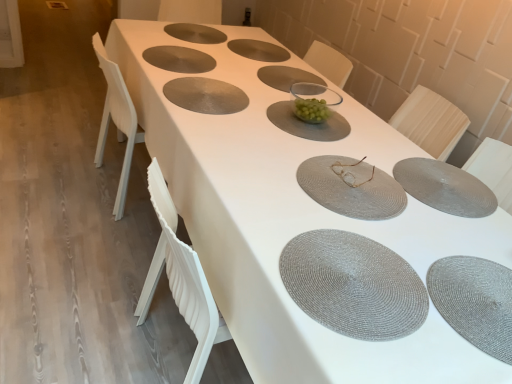
The width and height of the screenshot is (512, 384). Find the location of `vacant space that is in between matte gray placemat at center, the seventh tableware when ordered from top to bottom, and green glass bowl at center, positioned as the 5th tableware in top-to-bottom order`. vacant space that is in between matte gray placemat at center, the seventh tableware when ordered from top to bottom, and green glass bowl at center, positioned as the 5th tableware in top-to-bottom order is located at coordinates (322, 144).